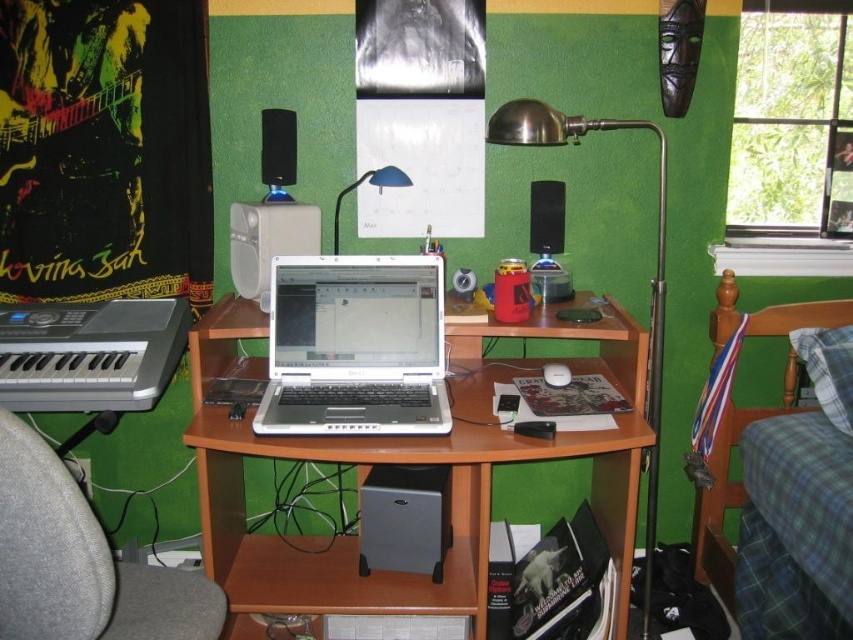
You are standing in the room and want to place a new monitor between the wooden computer desk at center and the silver metallic laptop at center. Which object should the monitor be placed closer to in order to maintain the existing spatial relationship?

The wooden computer desk at center is closer to the viewer than the silver metallic laptop at center, so the monitor should be placed closer to the silver metallic laptop at center to maintain the existing spatial relationship.

You are standing at the center of the room and want to place a new plant between the two points marked as point [392,332] and point [9,412]. Since you can only move forward or backward along the line connecting them, will the plant be closer to the desk or the wall?

The plant will be closer to the desk because point [392,332] is behind point [9,412], meaning the desk is closer to point [9,412]. Therefore, placing the plant between them would position it nearer to the desk.

You are setting up a new desk arrangement and want to place a large plant between the wooden computer desk at center and the white plastic speaker at center. Given that the desk is larger than the speaker, where should the plant be placed to ensure it is closer to the smaller object?

The plant should be placed closer to the white plastic speaker at center since it is the smaller object between the wooden computer desk at center and the white plastic speaker at center.